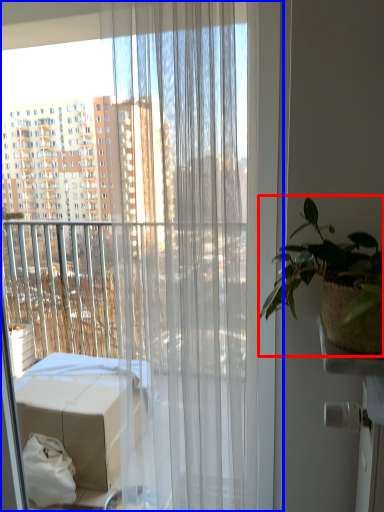
Question: Which point is further to the camera, houseplant (highlighted by a red box) or curtain (highlighted by a blue box)?

Choices:
 (A) houseplant
 (B) curtain

Answer: (B)